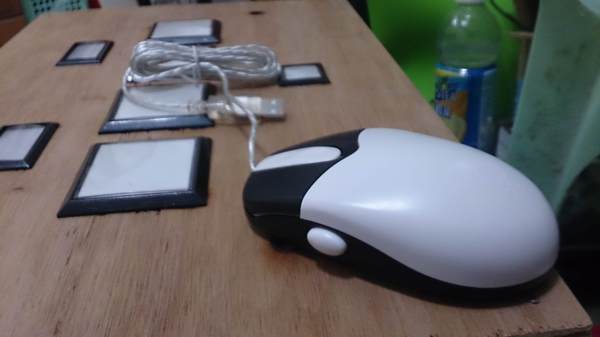
This screenshot has width=600, height=337. Identify the location of glass globe of gumball machine. (477, 39).